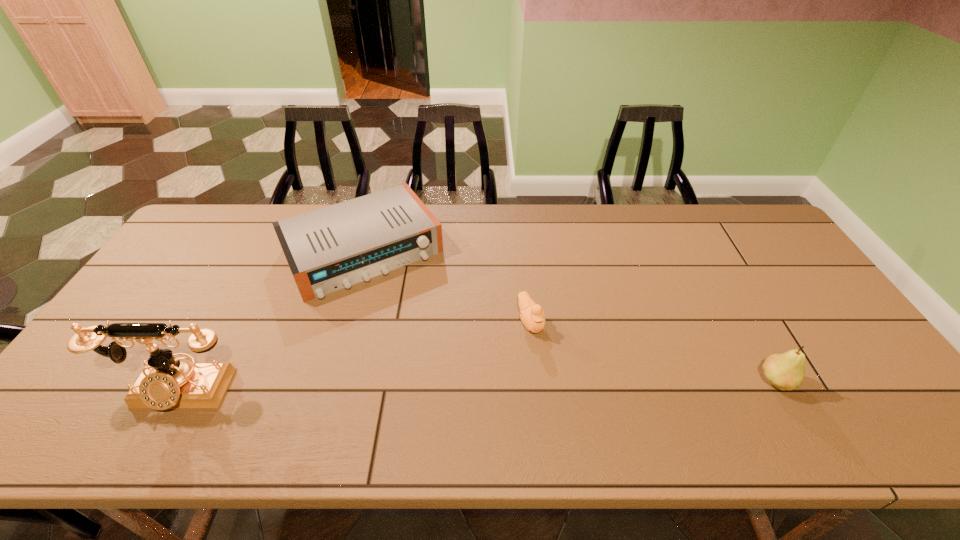
Where is `vacant region between the farthest object and the rightmost object`? This screenshot has height=540, width=960. vacant region between the farthest object and the rightmost object is located at coordinates (569, 316).

Identify the location of free space between the radio receiver and the tallest object. The image size is (960, 540). (272, 321).

This screenshot has width=960, height=540. Identify the location of free area in between the tallest object and the farthest object. (272, 321).

The height and width of the screenshot is (540, 960). Identify the location of object that stands as the second closest to the duckling. (785, 371).

Identify which object is the closest to the duckling. Please provide its 2D coordinates. Your answer should be formatted as a tuple, i.e. [(x, y)], where the tuple contains the x and y coordinates of a point satisfying the conditions above.

[(334, 247)]

At what (x,y) coordinates should I click in order to perform the action: click on vacant space that satisfies the following two spatial constraints: 1. on the front side of the rightmost object; 2. on the left side of the third object from left to right. Please return your answer as a coordinate pair (x, y). The image size is (960, 540). Looking at the image, I should click on (538, 382).